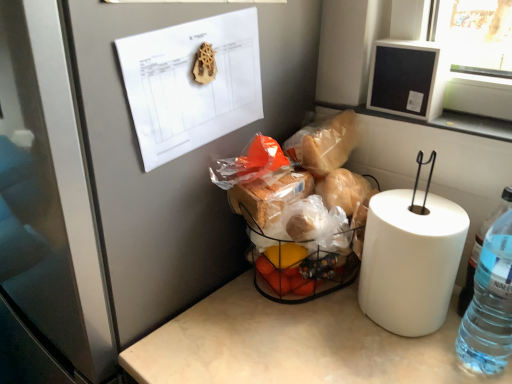
Where is `blank space situated above white glossy frame at upper right (from a real-world perspective)`? blank space situated above white glossy frame at upper right (from a real-world perspective) is located at coordinates (461, 116).